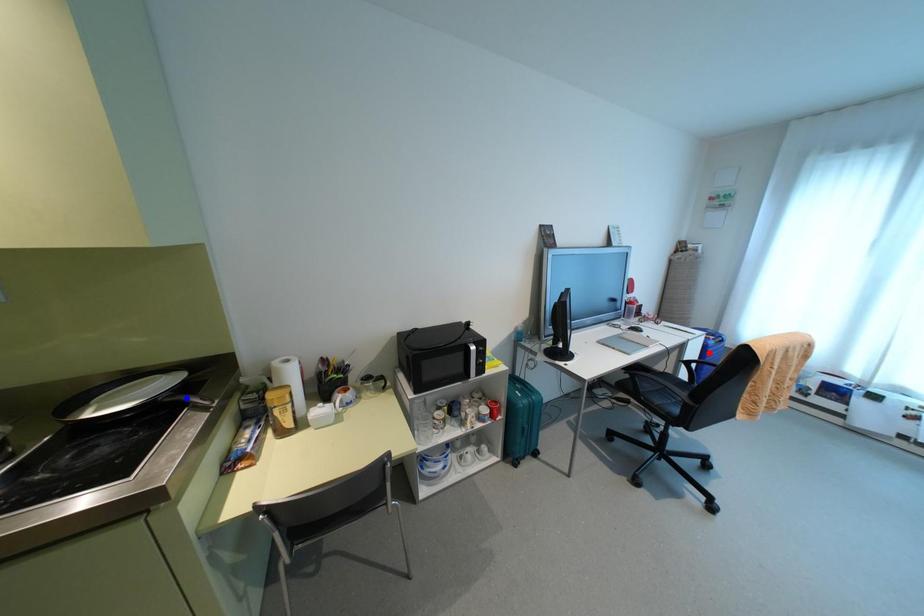
Question: In the image, two points are highlighted. Which point is nearer to the camera? Reply with the corresponding letter.

Choices:
 (A) blue point
 (B) red point

Answer: (A)